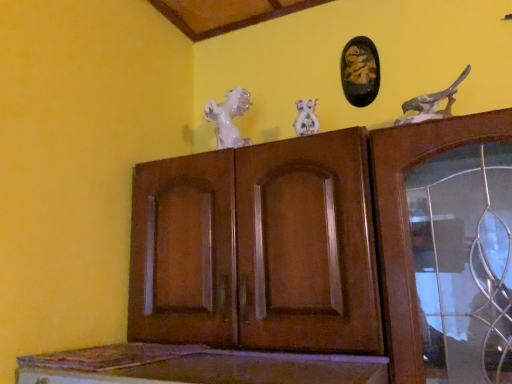
Question: From a real-world perspective, is brown wood cupboard at center physically located above or below black glossy picture frame at upper center?

Choices:
 (A) below
 (B) above

Answer: (A)

Question: Is brown wood cupboard at center bigger or smaller than black glossy picture frame at upper center?

Choices:
 (A) small
 (B) big

Answer: (B)

Question: Which object is positioned closest to the black glossy picture frame at upper center?

Choices:
 (A) speckled stone bird at upper right, the first animal in the right-to-left sequence
 (B) white porcelain horse at upper center, the second animal from the front
 (C) brown wood cupboard at center
 (D) white porcelain dog at center

Answer: (A)

Question: Which object is the farthest from the brown wood cupboard at center?

Choices:
 (A) speckled stone bird at upper right, arranged as the first animal when viewed from the front
 (B) white porcelain horse at upper center, the second animal from the front
 (C) black glossy picture frame at upper center
 (D) white porcelain dog at center

Answer: (C)